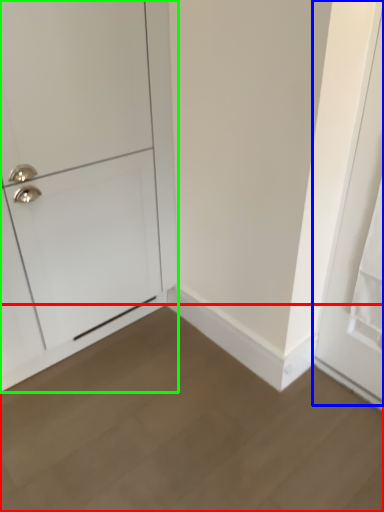
Question: Which is farther away from plain (highlighted by a red box)? door (highlighted by a blue box) or door (highlighted by a green box)?

Choices:
 (A) door
 (B) door

Answer: (B)